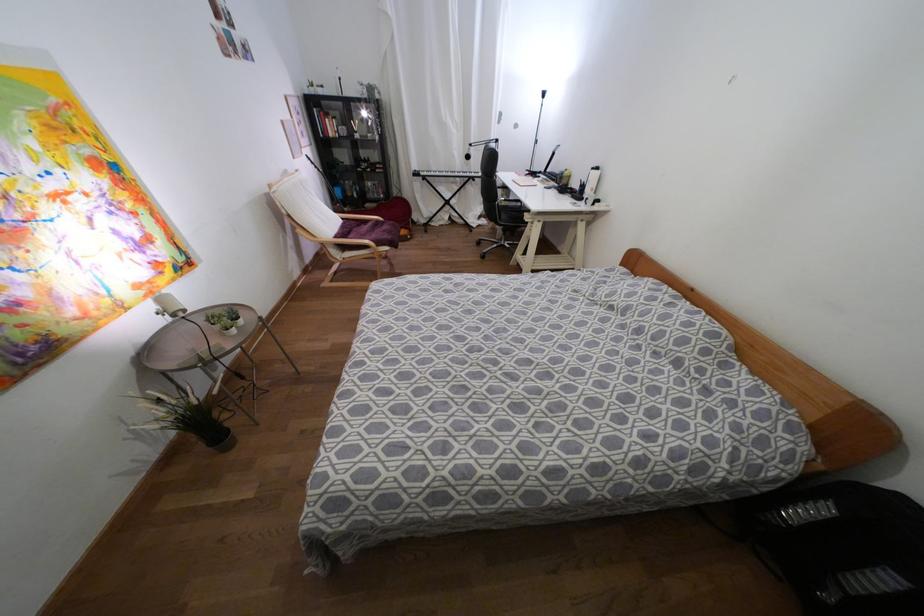
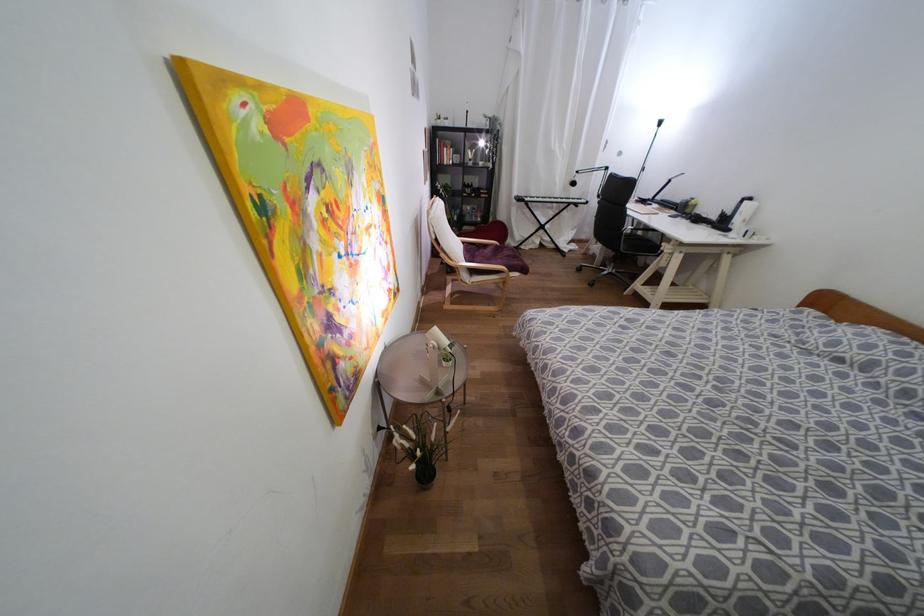
Question: In a continuous first-person perspective shot, in which direction is the camera moving?

Choices:
 (A) Left
 (B) Right
 (C) Forward
 (D) Backward

Answer: (A)